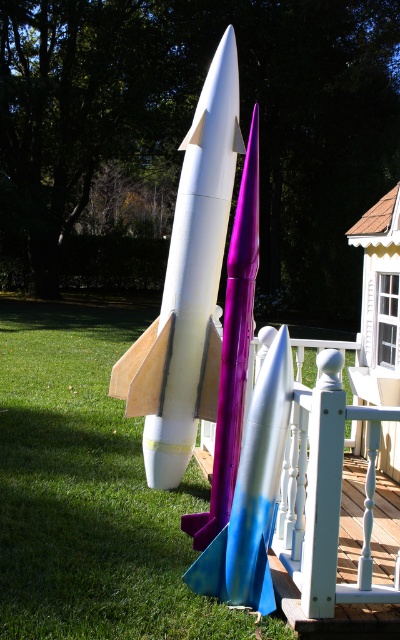
You are standing at the center of the grassy lawn and want to locate the matte purple rocket at center. According to the coordinates provided, where should you look relative to your position?

The matte purple rocket at center is located at coordinates point (252, 493), which means it is positioned to the right and slightly above your current position on the grassy lawn.

You are a photographer setting up a shot of the white matte rocket at center and the matte purple rocket at center. You need to ensure that both rockets are fully visible in the frame. Given that your camera has a fixed width, which rocket requires more horizontal space to capture its full width?

The white matte rocket at center requires more horizontal space because its width surpasses that of the matte purple rocket at center.

You are a photographer setting up a shot of the white matte rocket at center and the matte purple rocket at center. You want to ensure that both rockets are fully visible in the frame. Given that the camera can only capture objects up to 1 meter in height, will you need to adjust the camera angle to accommodate the taller rocket?

The white matte rocket at center is taller than the matte purple rocket at center. Since the camera can only capture up to 1 meter in height, you need to check the height of the white matte rocket at center. If it exceeds 1 meter, adjusting the camera angle would be necessary to ensure it fits within the frame.